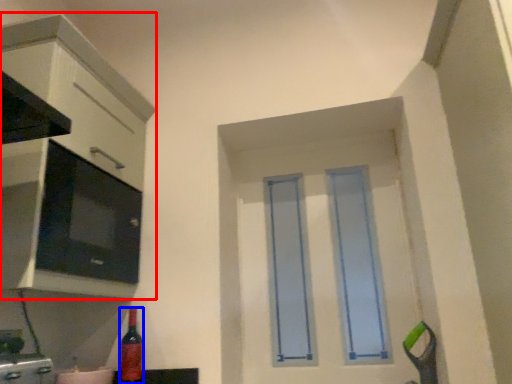
Question: Among these objects, which one is farthest to the camera, cabinetry (highlighted by a red box) or bottle (highlighted by a blue box)?

Choices:
 (A) cabinetry
 (B) bottle

Answer: (B)